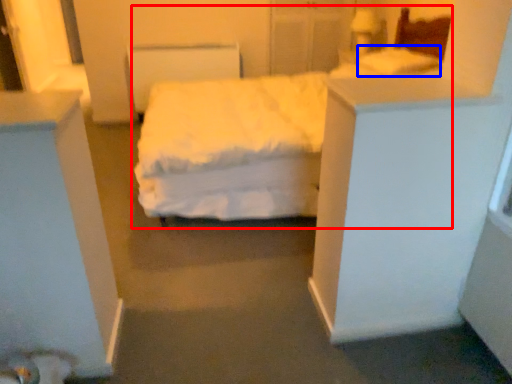
Question: Which of the following is the farthest to the observer, bed (highlighted by a red box) or pillow (highlighted by a blue box)?

Choices:
 (A) bed
 (B) pillow

Answer: (B)